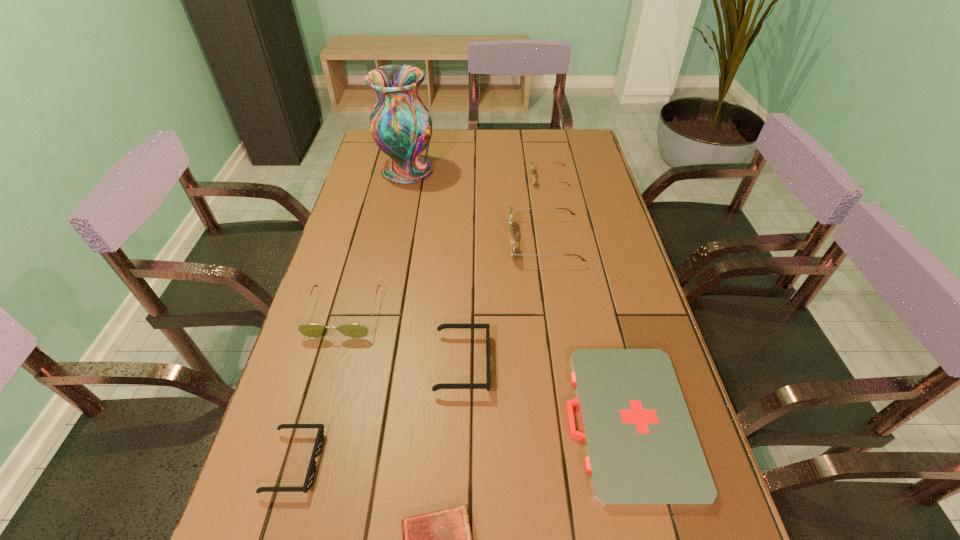
Where is `vase`? The height and width of the screenshot is (540, 960). vase is located at coordinates (401, 126).

You are a GUI agent. You are given a task and a screenshot of the screen. Output one action in this format:
    pyautogui.click(x=<x>, y=<y>)
    Task: Click on the biggest green sunglasses
    The image size is (960, 540).
    Given the screenshot: What is the action you would take?
    pyautogui.click(x=512, y=229)

This screenshot has height=540, width=960. What are the coordinates of `the tallest sunglasses` in the screenshot? It's located at (512, 229).

This screenshot has height=540, width=960. I want to click on the third tallest object, so click(x=316, y=331).

This screenshot has height=540, width=960. In order to click on the second biggest green sunglasses in this screenshot , I will do `click(316, 331)`.

Find the location of a particular element. The image size is (960, 540). the farthest green sunglasses is located at coordinates (532, 162).

Locate an element on the screen. The height and width of the screenshot is (540, 960). the farthest sunglasses is located at coordinates tap(532, 162).

Locate an element on the screen. The height and width of the screenshot is (540, 960). the right black sunglasses is located at coordinates (487, 385).

Locate an element on the screen. This screenshot has height=540, width=960. the bigger black sunglasses is located at coordinates (487, 385).

Find the location of a particular element. The image size is (960, 540). the third shortest object is located at coordinates (311, 472).